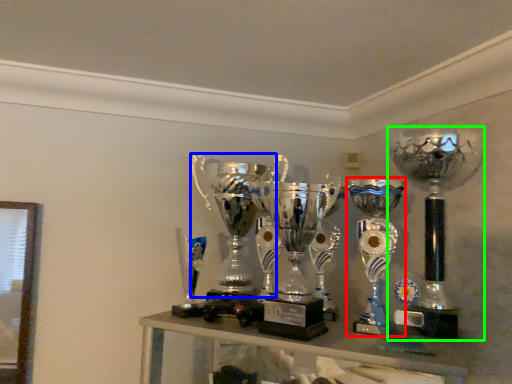
Question: Which is nearer to the trophy (highlighted by a red box)? trophy (highlighted by a blue box) or trophy (highlighted by a green box).

Choices:
 (A) trophy
 (B) trophy

Answer: (B)